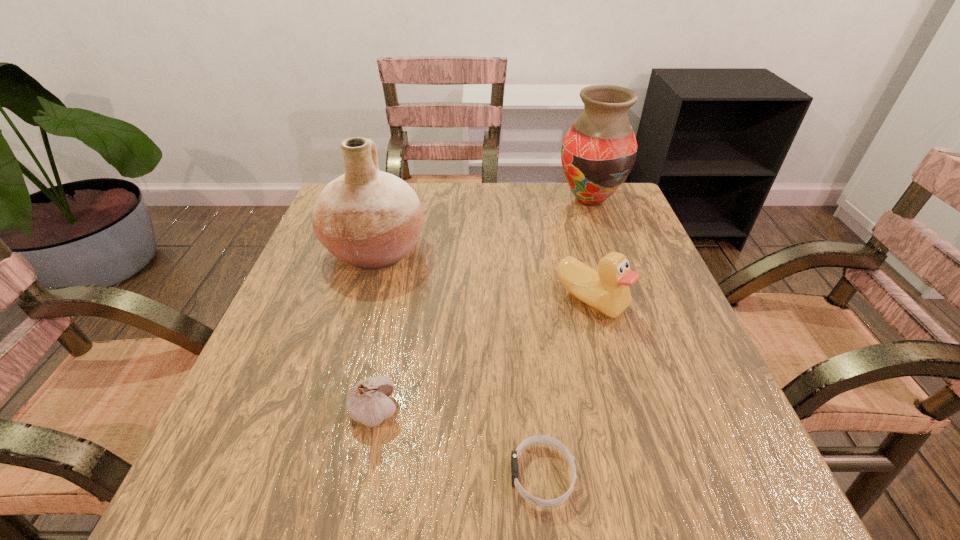
Image resolution: width=960 pixels, height=540 pixels. I want to click on vacant point located between the duck and the pottery, so click(483, 275).

Where is `vacant area between the farthest object and the garlic`? vacant area between the farthest object and the garlic is located at coordinates (482, 306).

Image resolution: width=960 pixels, height=540 pixels. Find the location of `free space that is in between the garlic and the duck`. free space that is in between the garlic and the duck is located at coordinates (483, 356).

Find the location of a particular element. The width and height of the screenshot is (960, 540). vacant area between the fourth tallest object and the wristband is located at coordinates (459, 443).

At what (x,y) coordinates should I click in order to perform the action: click on empty space between the duck and the farthest object. Please return your answer as a coordinate pair (x, y). This screenshot has width=960, height=540. Looking at the image, I should click on (590, 250).

Identify the location of free space between the vase and the duck. (590, 250).

Where is `free space between the farthest object and the third tallest object`? free space between the farthest object and the third tallest object is located at coordinates (590, 250).

Identify the location of free spot between the second nearest object and the third tallest object. Image resolution: width=960 pixels, height=540 pixels. (483, 356).

Locate an element on the screen. The width and height of the screenshot is (960, 540). object that can be found as the closest to the second shortest object is located at coordinates (544, 439).

Identify which object is the third nearest to the fourth farthest object. Please provide its 2D coordinates. Your answer should be formatted as a tuple, i.e. [(x, y)], where the tuple contains the x and y coordinates of a point satisfying the conditions above.

[(607, 290)]